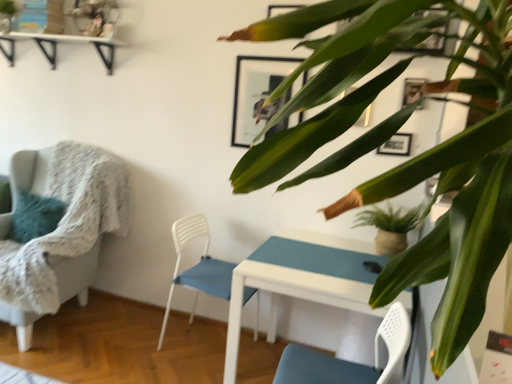
Question: Can you confirm if white glossy table at center is thinner than green glossy leafy plant at upper right, positioned as the first houseplant in left-to-right order?

Choices:
 (A) yes
 (B) no

Answer: (B)

Question: Is white glossy table at center facing away from green glossy leafy plant at upper right, positioned as the first houseplant in left-to-right order?

Choices:
 (A) no
 (B) yes

Answer: (A)

Question: From the image's perspective, is white glossy table at center under green glossy leafy plant at upper right, which appears as the first houseplant when viewed from the front?

Choices:
 (A) no
 (B) yes

Answer: (B)

Question: Does white glossy table at center come behind green glossy leafy plant at upper right, which is counted as the second houseplant, starting from the back?

Choices:
 (A) no
 (B) yes

Answer: (B)

Question: Is white glossy table at center beside green glossy leafy plant at upper right, positioned as the first houseplant in left-to-right order?

Choices:
 (A) yes
 (B) no

Answer: (B)

Question: Is textured gray armchair at left, which appears as the second chair when viewed from the right, inside the boundaries of green matte houseplant at center, the second houseplant when ordered from front to back, or outside?

Choices:
 (A) inside
 (B) outside

Answer: (B)

Question: From a real-world perspective, is textured gray armchair at left, which appears as the first chair when viewed from the left, positioned above or below green matte houseplant at center, which is the first houseplant in back-to-front order?

Choices:
 (A) above
 (B) below

Answer: (B)

Question: In terms of size, does textured gray armchair at left, which appears as the second chair when viewed from the right, appear bigger or smaller than green matte houseplant at center, the second houseplant when ordered from front to back?

Choices:
 (A) big
 (B) small

Answer: (A)

Question: Is textured gray armchair at left, which appears as the second chair when viewed from the right, in front of or behind green matte houseplant at center, which is the first houseplant in back-to-front order, in the image?

Choices:
 (A) front
 (B) behind

Answer: (A)

Question: Is textured gray armchair at left, which appears as the first chair when viewed from the left, in front of or behind white glossy table at center in the image?

Choices:
 (A) front
 (B) behind

Answer: (B)

Question: Is textured gray armchair at left, which appears as the second chair when viewed from the right, situated inside white glossy table at center or outside?

Choices:
 (A) inside
 (B) outside

Answer: (B)

Question: From the image's perspective, relative to white glossy table at center, is textured gray armchair at left, which appears as the second chair when viewed from the right, above or below?

Choices:
 (A) above
 (B) below

Answer: (A)

Question: From a real-world perspective, is textured gray armchair at left, which appears as the second chair when viewed from the right, physically located above or below white glossy table at center?

Choices:
 (A) above
 (B) below

Answer: (A)

Question: Is matte black picture frame at upper center taller or shorter than green matte houseplant at center, which is counted as the 1th houseplant, starting from the right?

Choices:
 (A) tall
 (B) short

Answer: (A)

Question: From the image's perspective, is matte black picture frame at upper center located above or below green matte houseplant at center, which is counted as the 1th houseplant, starting from the right?

Choices:
 (A) below
 (B) above

Answer: (B)